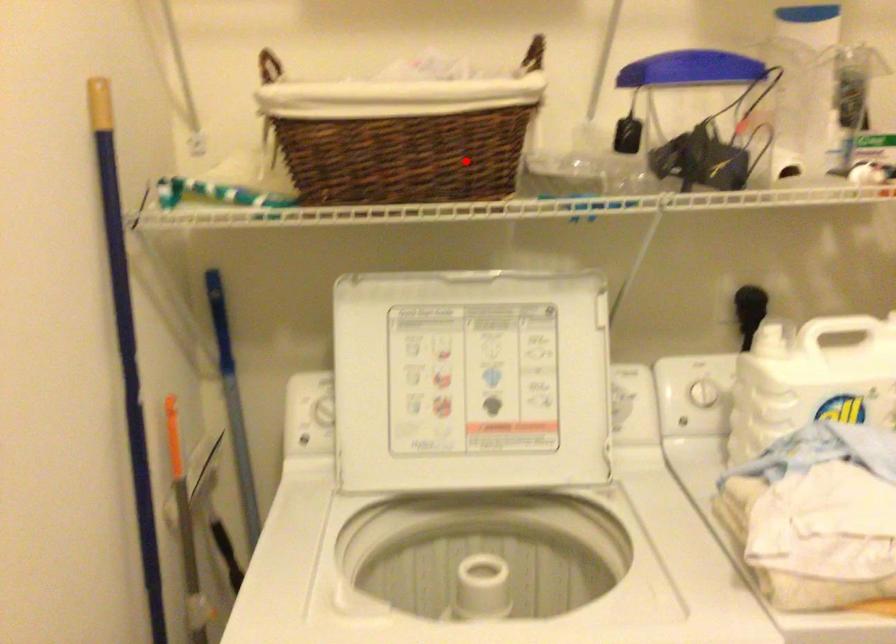
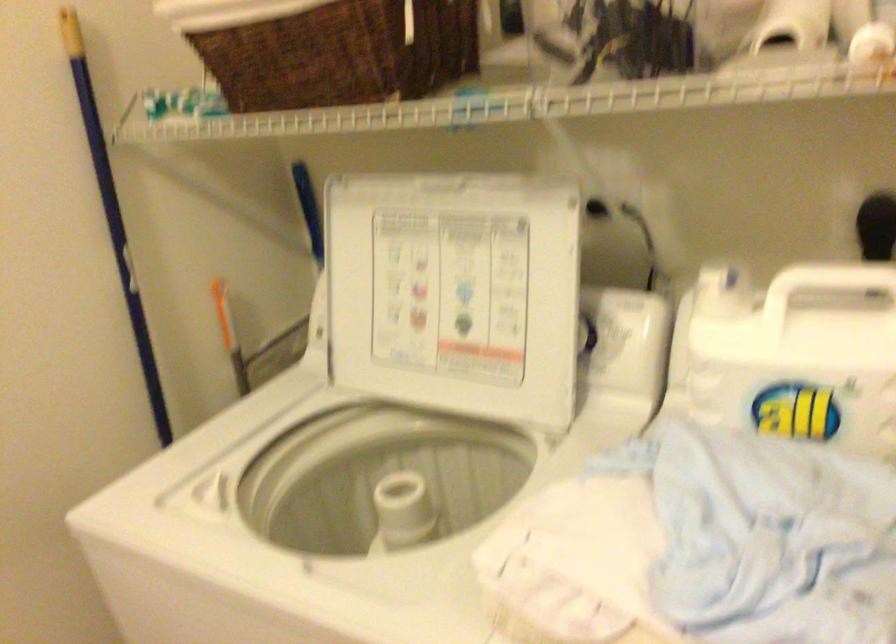
Where in the second image is the point corresponding to the highlighted location from the first image?

(340, 53)